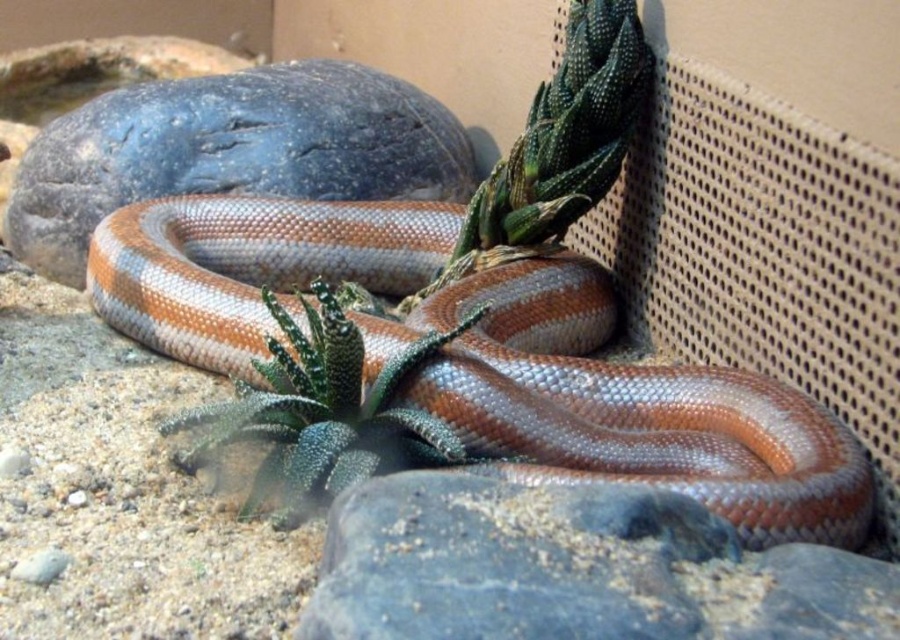
You are a gardener who wants to place a small statue between the smooth gray rock at upper left and the green spiky cactus at center. Which object should you move closer to you to create space?

To create space for the statue, you should move the smooth gray rock at upper left closer to you because it is already closer to you than the green spiky cactus at center.

You are standing in front of the scene and want to pick up the smooth gray rock at upper left. Can you reach it without moving your feet?

The smooth gray rock at upper left is 2.49 meters away from viewer, so you cannot reach it without moving your feet since the typical reaching distance for an adult is about 1 meter.

You are a hiker who just spotted the shiny brown snake at center and the smooth gray rock at upper left in the image. Which object is positioned more to the left side of the scene?

The smooth gray rock at upper left is positioned more to the left side of the scene than the shiny brown snake at center.